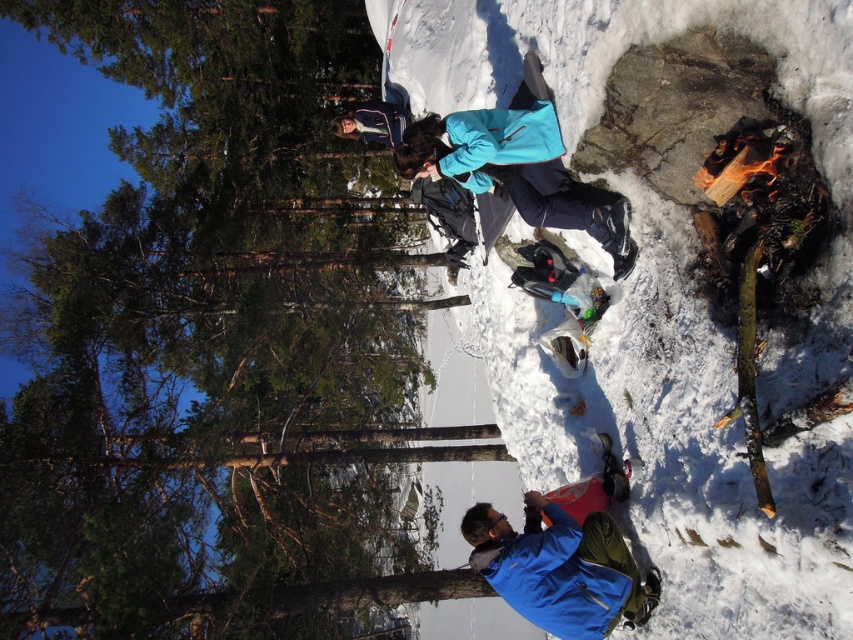
Between green matte tree at upper left and blue fabric jacket at lower center, which one is positioned higher?

green matte tree at upper left is higher up.

Which is behind, point (303, 618) or point (547, 529)?

The point (303, 618) is more distant.

Where is `green matte tree at upper left`? Image resolution: width=853 pixels, height=640 pixels. green matte tree at upper left is located at coordinates (215, 339).

Based on the photo, is green matte tree at upper left above white fluffy snow at lower right?

Actually, green matte tree at upper left is below white fluffy snow at lower right.

Where is `green matte tree at upper left`? green matte tree at upper left is located at coordinates (215, 339).

Which is behind, point (386, 480) or point (592, 250)?

The point (386, 480) is more distant.

I want to click on green matte tree at upper left, so click(215, 339).

Does white fluffy snow at lower right have a lesser height compared to blue fabric jacket at lower center?

Incorrect, white fluffy snow at lower right's height does not fall short of blue fabric jacket at lower center's.

Is white fluffy snow at lower right below blue fabric jacket at lower center?

Incorrect, white fluffy snow at lower right is not positioned below blue fabric jacket at lower center.

Which is in front, point (839, 368) or point (637, 580)?

Positioned in front is point (839, 368).

Find the location of a particular element. The height and width of the screenshot is (640, 853). white fluffy snow at lower right is located at coordinates (714, 461).